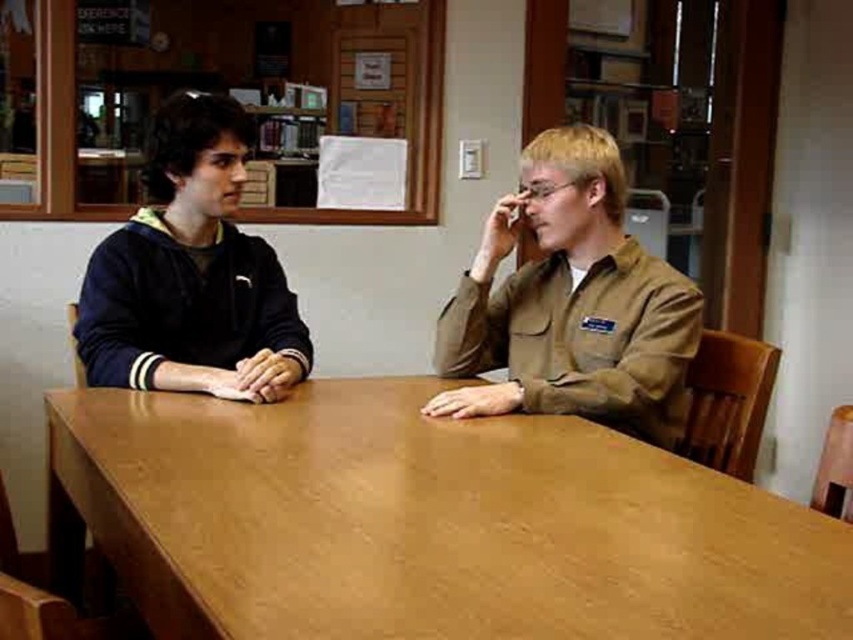
You are a delivery person who needs to place a rectangular package that measures 1 meter in length on the brown wood table at center without overlapping the brown cotton shirt at right. Is there enough space on the table for the package?

The brown wood table at center has a larger size compared to brown cotton shirt at right, so there is sufficient space to place the 1 meter long package without overlapping the brown cotton shirt at right.

You are a furniture designer evaluating the space between the brown wood table at center and the dark blue fleece at left. Can you determine if the table is larger in size compared to the fleece?

The brown wood table at center is bigger than dark blue fleece at left, so yes, the table is larger in size compared to the fleece.

You are standing at the entrance of the library and see a point marked at coordinates (422,524). Based on the scene description, can you determine what object this point is located on?

The point at coordinates (422,524) is located on the brown wood table at center.